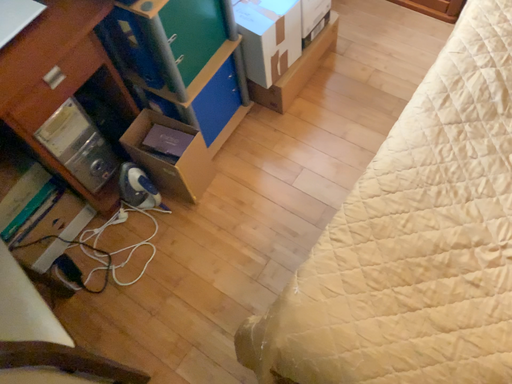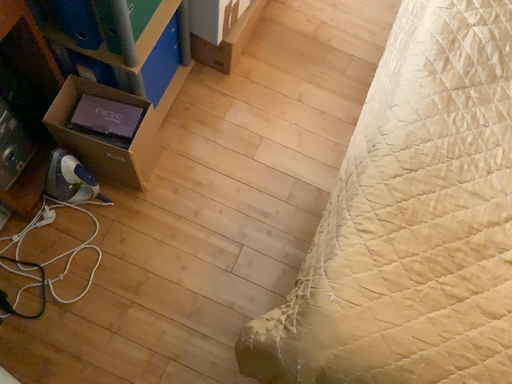
Question: How did the camera likely rotate when shooting the video?

Choices:
 (A) rotated left
 (B) rotated right

Answer: (B)